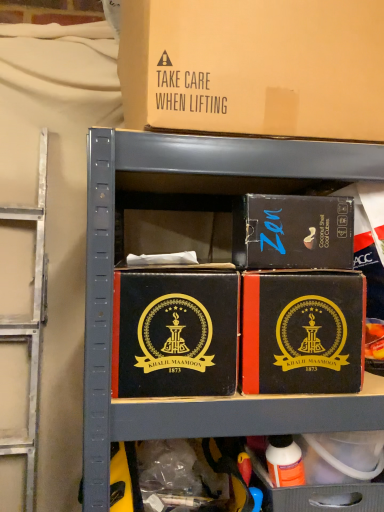
You are a GUI agent. You are given a task and a screenshot of the screen. Output one action in this format:
    pyautogui.click(x=<x>, y=<y>)
    Task: Click on the matte black box at center, placed as the fourth box when sorted from top to bottom
    This screenshot has height=512, width=384.
    Given the screenshot: What is the action you would take?
    pyautogui.click(x=303, y=332)

Where is `brown cardboard box at upper center, which appears as the first box when viewed from the top`? Image resolution: width=384 pixels, height=512 pixels. brown cardboard box at upper center, which appears as the first box when viewed from the top is located at coordinates (254, 67).

Measure the distance between point (x=208, y=37) and camera.

They are 21.54 inches apart.

What is the approximate width of black leather box at center, which is the 2th box from bottom to top?

It is 25.42 inches.

Measure the distance between point (254, 225) and camera.

Point (254, 225) and camera are 61.20 centimeters apart.

Where is `matte black box at center, placed as the fourth box when sorted from top to bottom`? matte black box at center, placed as the fourth box when sorted from top to bottom is located at coordinates click(x=303, y=332).

Considering the positions of objects brown cardboard box at upper center, which appears as the first box when viewed from the top, and black leather box at center, which is the 2th box from bottom to top, in the image provided, who is more to the right, brown cardboard box at upper center, which appears as the first box when viewed from the top, or black leather box at center, which is the 2th box from bottom to top,?

brown cardboard box at upper center, which appears as the first box when viewed from the top.

Does brown cardboard box at upper center, which is the fourth box in bottom-to-top order, have a larger size compared to black leather box at center, which is the 2th box from bottom to top?

Yes, brown cardboard box at upper center, which is the fourth box in bottom-to-top order, is bigger than black leather box at center, which is the 2th box from bottom to top.

Measure the distance from brown cardboard box at upper center, which is the fourth box in bottom-to-top order, to black leather box at center, which is the 2th box from bottom to top.

brown cardboard box at upper center, which is the fourth box in bottom-to-top order, and black leather box at center, which is the 2th box from bottom to top, are 11.14 inches apart from each other.

This screenshot has height=512, width=384. I want to click on the 2nd box above the black leather box at center, positioned as the third box in top-to-bottom order (from the image's perspective), so click(x=254, y=67).

Is matte black box at upper right, arranged as the second box when viewed from the top, beside matte black box at center, acting as the 1th box starting from the bottom?

Indeed, matte black box at upper right, arranged as the second box when viewed from the top, and matte black box at center, acting as the 1th box starting from the bottom, are beside each other and touching.

Looking at the image, does matte black box at upper right, marked as the third box in a bottom-to-top arrangement, seem bigger or smaller compared to matte black box at center, placed as the fourth box when sorted from top to bottom?

Considering their sizes, matte black box at upper right, marked as the third box in a bottom-to-top arrangement, takes up less space than matte black box at center, placed as the fourth box when sorted from top to bottom.

Which is behind, matte black box at upper right, marked as the third box in a bottom-to-top arrangement, or matte black box at center, acting as the 1th box starting from the bottom?

Positioned behind is matte black box at upper right, marked as the third box in a bottom-to-top arrangement.

Looking at this image, does matte black box at upper right, arranged as the second box when viewed from the top, contain matte black box at center, acting as the 1th box starting from the bottom?

Actually, matte black box at center, acting as the 1th box starting from the bottom, is outside matte black box at upper right, arranged as the second box when viewed from the top.

Which is behind, point (283, 367) or point (215, 383)?

Positioned behind is point (283, 367).

Considering the relative sizes of matte black box at center, acting as the 1th box starting from the bottom, and black leather box at center, positioned as the third box in top-to-bottom order, in the image provided, is matte black box at center, acting as the 1th box starting from the bottom, bigger than black leather box at center, positioned as the third box in top-to-bottom order,?

No.

Considering the relative sizes of matte black box at center, acting as the 1th box starting from the bottom, and black leather box at center, which is the 2th box from bottom to top, in the image provided, is matte black box at center, acting as the 1th box starting from the bottom, wider than black leather box at center, which is the 2th box from bottom to top,?

In fact, matte black box at center, acting as the 1th box starting from the bottom, might be narrower than black leather box at center, which is the 2th box from bottom to top.

Is point (371, 73) positioned before point (318, 267)?

Yes, point (371, 73) is in front of point (318, 267).

From a real-world perspective, is brown cardboard box at upper center, which appears as the first box when viewed from the top, above or below matte black box at upper right, marked as the third box in a bottom-to-top arrangement?

In terms of real-world spatial position, brown cardboard box at upper center, which appears as the first box when viewed from the top, is above matte black box at upper right, marked as the third box in a bottom-to-top arrangement.

From the image's perspective, which is below, brown cardboard box at upper center, which appears as the first box when viewed from the top, or matte black box at upper right, marked as the third box in a bottom-to-top arrangement?

From the image's view, matte black box at upper right, marked as the third box in a bottom-to-top arrangement, is below.

Could you measure the distance between black leather box at center, positioned as the third box in top-to-bottom order, and matte black box at upper right, arranged as the second box when viewed from the top?

black leather box at center, positioned as the third box in top-to-bottom order, is 13.22 centimeters away from matte black box at upper right, arranged as the second box when viewed from the top.

Does black leather box at center, positioned as the third box in top-to-bottom order, have a larger size compared to matte black box at upper right, arranged as the second box when viewed from the top?

Indeed, black leather box at center, positioned as the third box in top-to-bottom order, has a larger size compared to matte black box at upper right, arranged as the second box when viewed from the top.

Considering the relative positions of black leather box at center, positioned as the third box in top-to-bottom order, and matte black box at upper right, marked as the third box in a bottom-to-top arrangement, in the image provided, is black leather box at center, positioned as the third box in top-to-bottom order, to the left or to the right of matte black box at upper right, marked as the third box in a bottom-to-top arrangement,?

black leather box at center, positioned as the third box in top-to-bottom order, is positioned on matte black box at upper right, marked as the third box in a bottom-to-top arrangement,'s left side.

Is black leather box at center, positioned as the third box in top-to-bottom order, located outside matte black box at upper right, arranged as the second box when viewed from the top?

Absolutely, black leather box at center, positioned as the third box in top-to-bottom order, is external to matte black box at upper right, arranged as the second box when viewed from the top.

Does black leather box at center, which is the 2th box from bottom to top, have a larger size compared to brown cardboard box at upper center, which appears as the first box when viewed from the top?

No.

You are a GUI agent. You are given a task and a screenshot of the screen. Output one action in this format:
    pyautogui.click(x=<x>, y=<y>)
    Task: Click on the box in front of the black leather box at center, which is the 2th box from bottom to top
    
    Given the screenshot: What is the action you would take?
    pyautogui.click(x=254, y=67)

Is brown cardboard box at upper center, which appears as the first box when viewed from the top, inside black leather box at center, which is the 2th box from bottom to top?

No, black leather box at center, which is the 2th box from bottom to top, does not contain brown cardboard box at upper center, which appears as the first box when viewed from the top.

Considering the positions of objects black leather box at center, positioned as the third box in top-to-bottom order, and brown cardboard box at upper center, which appears as the first box when viewed from the top, in the image provided, who is more to the right, black leather box at center, positioned as the third box in top-to-bottom order, or brown cardboard box at upper center, which appears as the first box when viewed from the top,?

brown cardboard box at upper center, which appears as the first box when viewed from the top, is more to the right.

Which is more to the right, matte black box at center, acting as the 1th box starting from the bottom, or matte black box at upper right, marked as the third box in a bottom-to-top arrangement?

matte black box at upper right, marked as the third box in a bottom-to-top arrangement, is more to the right.

Is matte black box at center, placed as the fourth box when sorted from top to bottom, positioned before matte black box at upper right, arranged as the second box when viewed from the top?

Yes.

The width and height of the screenshot is (384, 512). I want to click on box that is the 1st one when counting backward from the brown cardboard box at upper center, which is the fourth box in bottom-to-top order, so (x=175, y=331).

The width and height of the screenshot is (384, 512). In order to click on the 2nd box directly above the matte black box at center, acting as the 1th box starting from the bottom (from a real-world perspective) in this screenshot , I will do `click(292, 232)`.

Estimate the real-world distances between objects in this image. Which object is further from matte black box at center, placed as the fourth box when sorted from top to bottom, brown cardboard box at upper center, which is the fourth box in bottom-to-top order, or matte black box at upper right, arranged as the second box when viewed from the top?

Among the two, brown cardboard box at upper center, which is the fourth box in bottom-to-top order, is located further to matte black box at center, placed as the fourth box when sorted from top to bottom.

Estimate the real-world distances between objects in this image. Which object is further from brown cardboard box at upper center, which is the fourth box in bottom-to-top order, matte black box at upper right, marked as the third box in a bottom-to-top arrangement, or matte black box at center, acting as the 1th box starting from the bottom?

Based on the image, matte black box at center, acting as the 1th box starting from the bottom, appears to be further to brown cardboard box at upper center, which is the fourth box in bottom-to-top order.

Looking at this image, from the image, which object appears to be farther from matte black box at center, placed as the fourth box when sorted from top to bottom, matte black box at upper right, marked as the third box in a bottom-to-top arrangement, or black leather box at center, which is the 2th box from bottom to top?

black leather box at center, which is the 2th box from bottom to top, is positioned further to the anchor matte black box at center, placed as the fourth box when sorted from top to bottom.

Estimate the real-world distances between objects in this image. Which object is closer to matte black box at center, acting as the 1th box starting from the bottom, brown cardboard box at upper center, which appears as the first box when viewed from the top, or black leather box at center, which is the 2th box from bottom to top?

Based on the image, black leather box at center, which is the 2th box from bottom to top, appears to be nearer to matte black box at center, acting as the 1th box starting from the bottom.

When comparing their distances from brown cardboard box at upper center, which is the fourth box in bottom-to-top order, does matte black box at upper right, marked as the third box in a bottom-to-top arrangement, or black leather box at center, positioned as the third box in top-to-bottom order, seem closer?

matte black box at upper right, marked as the third box in a bottom-to-top arrangement, is closer to brown cardboard box at upper center, which is the fourth box in bottom-to-top order.

Considering their positions, is matte black box at center, placed as the fourth box when sorted from top to bottom, positioned further to black leather box at center, which is the 2th box from bottom to top, than brown cardboard box at upper center, which is the fourth box in bottom-to-top order?

brown cardboard box at upper center, which is the fourth box in bottom-to-top order, lies further to black leather box at center, which is the 2th box from bottom to top, than the other object.

When comparing their distances from brown cardboard box at upper center, which is the fourth box in bottom-to-top order, does black leather box at center, positioned as the third box in top-to-bottom order, or matte black box at center, placed as the fourth box when sorted from top to bottom, seem closer?

matte black box at center, placed as the fourth box when sorted from top to bottom, is positioned closer to the anchor brown cardboard box at upper center, which is the fourth box in bottom-to-top order.

Looking at the image, which one is located further to black leather box at center, which is the 2th box from bottom to top, brown cardboard box at upper center, which is the fourth box in bottom-to-top order, or matte black box at center, placed as the fourth box when sorted from top to bottom?

Among the two, brown cardboard box at upper center, which is the fourth box in bottom-to-top order, is located further to black leather box at center, which is the 2th box from bottom to top.

Locate an element on the screen. This screenshot has width=384, height=512. box between brown cardboard box at upper center, which is the fourth box in bottom-to-top order, and black leather box at center, positioned as the third box in top-to-bottom order, in the up-down direction is located at coordinates (292, 232).